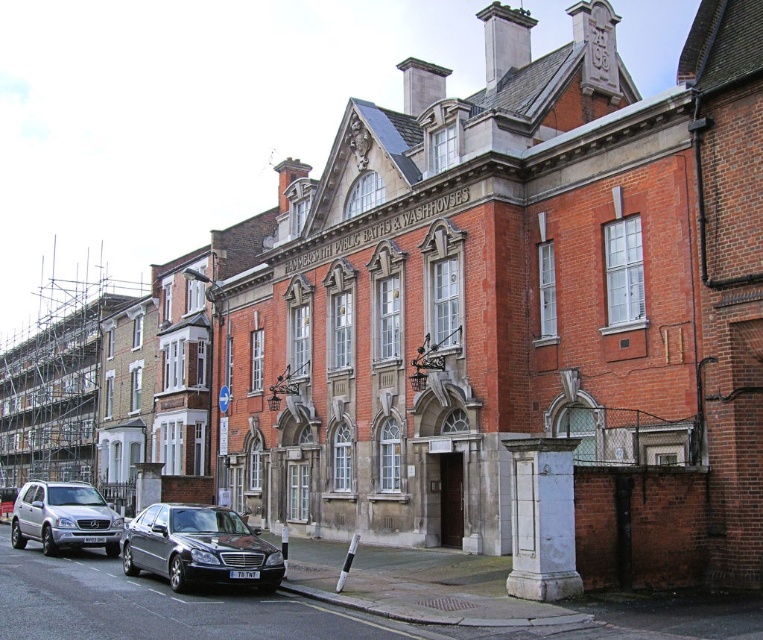
You are a pedestrian standing on the sidewalk in front of the HAMPSTEAD PUBLIC BATHS building. You see a shiny black sedan at lower center and a silver metallic suv at lower left. Which vehicle is closer to the building entrance?

The shiny black sedan at lower center is closer to the building entrance because it is positioned above the silver metallic suv at lower left, indicating it is nearer in the scene.

You are standing at the entrance of the HAMPSTEAD PUBLIC BATHS building and see two points marked on the ground. The first point is at coordinate point (x=15, y=339) and the second is at point (x=40, y=513). If you want to walk towards the point that is further away from you, which coordinate should you head towards?

Point (x=15, y=339) is behind point (x=40, y=513), so you should head towards point (x=15, y=339) to walk towards the one further away.